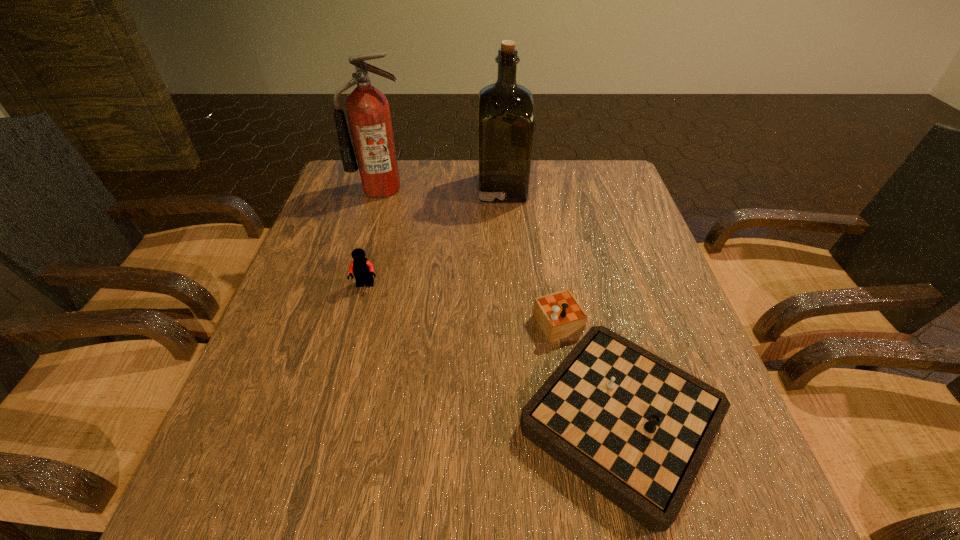
The image size is (960, 540). I want to click on empty space between the nearest object and the fire extinguisher, so click(498, 293).

The width and height of the screenshot is (960, 540). What are the coordinates of `free area in between the Lego and the chessboard` in the screenshot? It's located at (491, 341).

I want to click on free spot between the fire extinguisher and the third farthest object, so click(x=373, y=237).

Image resolution: width=960 pixels, height=540 pixels. Find the location of `free space between the liquor and the fire extinguisher`. free space between the liquor and the fire extinguisher is located at coordinates (442, 188).

Locate which object ranks third in proximity to the third farthest object. Please provide its 2D coordinates. Your answer should be formatted as a tuple, i.e. [(x, y)], where the tuple contains the x and y coordinates of a point satisfying the conditions above.

[(505, 110)]

Locate which object ranks in proximity to the Lego. Please provide its 2D coordinates. Your answer should be formatted as a tuple, i.e. [(x, y)], where the tuple contains the x and y coordinates of a point satisfying the conditions above.

[(636, 428)]

Where is `vacant position in the image that satisfies the following two spatial constraints: 1. on the label of the liquor; 2. on the front of the fire extinguisher near the operation label`? The width and height of the screenshot is (960, 540). vacant position in the image that satisfies the following two spatial constraints: 1. on the label of the liquor; 2. on the front of the fire extinguisher near the operation label is located at coordinates (502, 188).

Image resolution: width=960 pixels, height=540 pixels. I want to click on free spot that satisfies the following two spatial constraints: 1. on the front-facing side of the Lego; 2. on the left side of the chessboard, so click(x=336, y=396).

Locate an element on the screen. The width and height of the screenshot is (960, 540). vacant region that satisfies the following two spatial constraints: 1. on the front of the chessboard near the operation label; 2. on the left side of the fire extinguisher is located at coordinates (321, 396).

Where is `free space that satisfies the following two spatial constraints: 1. on the label of the liquor; 2. on the left side of the nearest object`? This screenshot has height=540, width=960. free space that satisfies the following two spatial constraints: 1. on the label of the liquor; 2. on the left side of the nearest object is located at coordinates (516, 396).